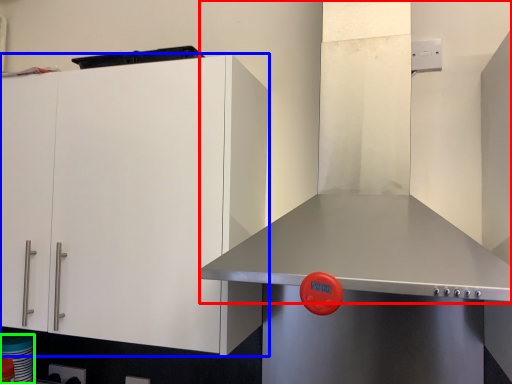
Question: Which object is positioned farthest from exhaust hood (highlighted by a red box)? Select from cabinetry (highlighted by a blue box) and appliance (highlighted by a green box).

Choices:
 (A) cabinetry
 (B) appliance

Answer: (B)